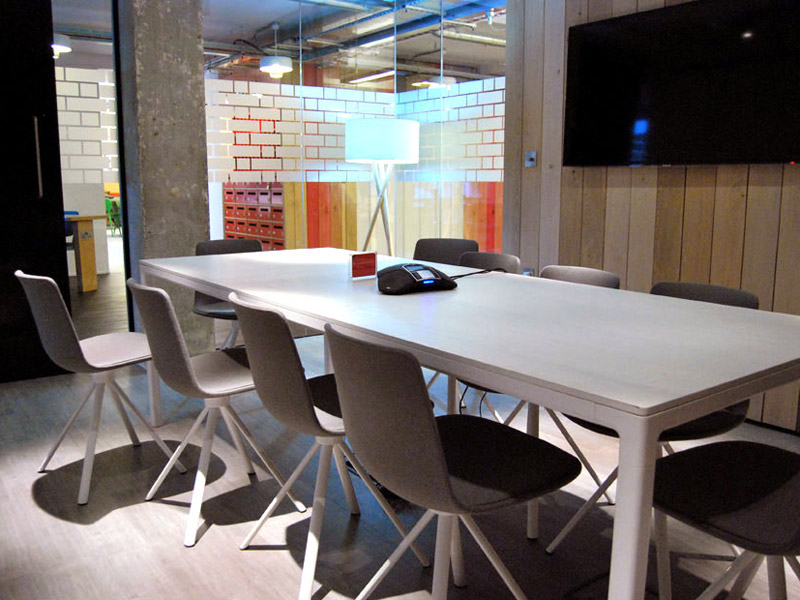
Find the location of `brick wallpaper design`. brick wallpaper design is located at coordinates (289, 106), (94, 147).